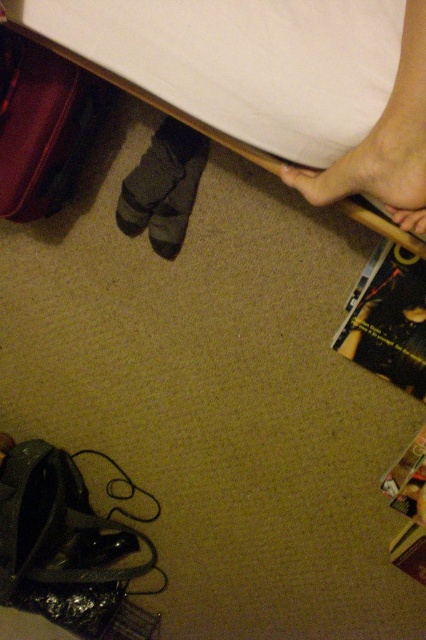
Consider the image. You are standing at the center of the room and want to pick up the black glossy magazine at lower right. Which direction should you move to reach it?

You should move towards the lower right direction to reach the black glossy magazine at lower right since it is located at point (388, 320).

From the picture: You are organizing the magazines on the stack. You need to place a new magazine between the black glossy magazine at lower right and the shiny metallic magazine at lower right. Where should you place it?

You should place the new magazine between the black glossy magazine at lower right and the shiny metallic magazine at lower right by putting it below the black glossy magazine at lower right and above the shiny metallic magazine at lower right since the black glossy magazine at lower right is above the shiny metallic magazine at lower right.

You are organizing items in a room and see the dark gray fabric sock at lower center and the shiny metallic magazine at lower right. Which item is covering the other one?

The dark gray fabric sock at lower center is positioned over the shiny metallic magazine at lower right, so it is covering it.